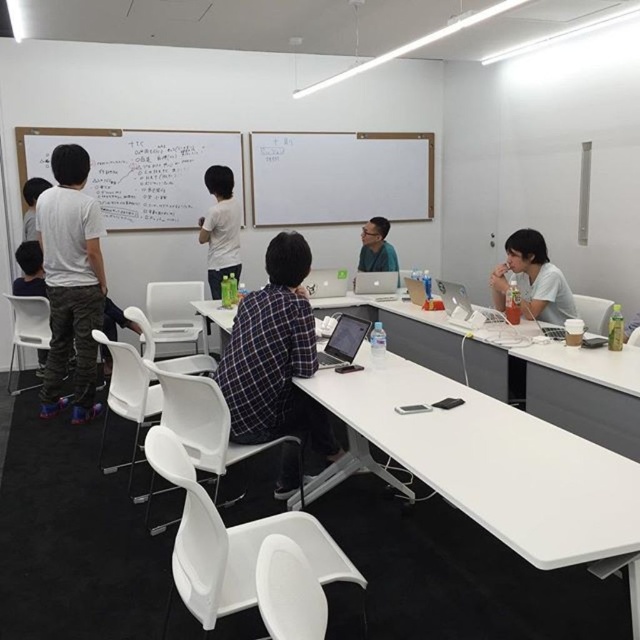
In the scene shown: You are a photographer setting up for a group photo in the meeting room. You notice two people wearing shirts labeled as matte white shirt at right and white matte shirt at upper center. To ensure both shirts are equally visible in the photo, which shirt should you position closer to the light source?

The matte white shirt at right is shorter than the white matte shirt at upper center. To make both shirts equally visible, position the shorter matte white shirt at right closer to the light source so that it receives more illumination, balancing their visibility.

You are a photographer setting up for a group photo in the meeting room. You need to position two subjects wearing the white cotton shirt at left and the white matte shirt at upper center. Since both shirts are white, you want to ensure they are distinguishable in the photo. Based on their positions, which shirt should you place on the left side of the frame to match their current arrangement?

The white cotton shirt at left should be placed on the left side of the frame because it is already positioned on the left side of the white matte shirt at upper center in the current arrangement.

You are a photographer taking a picture of the plaid fabric shirt at center and the satin black laptop at center. Which object will appear larger in the photo?

The plaid fabric shirt at center will appear larger in the photo because it is closer to the viewer than the satin black laptop at center.